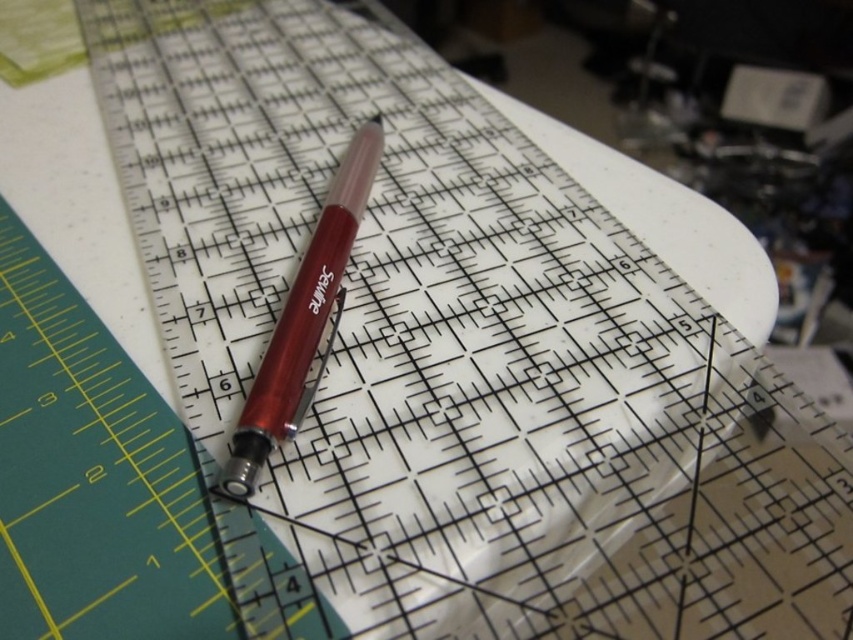
You need to place both the translucent plastic ruler at upper center and the metallic red pen at center into a storage box. The box can only hold items that are smaller than 15 cm in length. Based on their sizes, will both items fit?

The translucent plastic ruler at upper center is larger than the metallic red pen at center. Since the ruler is larger and the box requires items smaller than 15 cm, we need to confirm the ruler is under 15 cm. However, the description only states the ruler is larger than the pen. Without exact measurements, we can assume the ruler might exceed the limit. Therefore, it might not fit, so check the ruler first.

You are trying to organize your crafting tools. You have two points marked on your ruler at coordinates point (64,330) and point (303,392). If you want to place a sticker between them, which point should the sticker be closer to to ensure it is in front of both points?

The sticker should be closer to point (303,392) because point (64,330) is behind point (303,392), so placing it near the front point ensures it is in front of both.

You are a craftsperson trying to place a small sticker on the ruler. If you want to ensure the sticker is visible over the metallic red pen at center, where should you place it on the translucent plastic ruler at upper center?

You should place the sticker on the part of the translucent plastic ruler at upper center that is in front of the metallic red pen at center. Since the ruler is in front of the pen, placing the sticker there would make it visible over the pen.